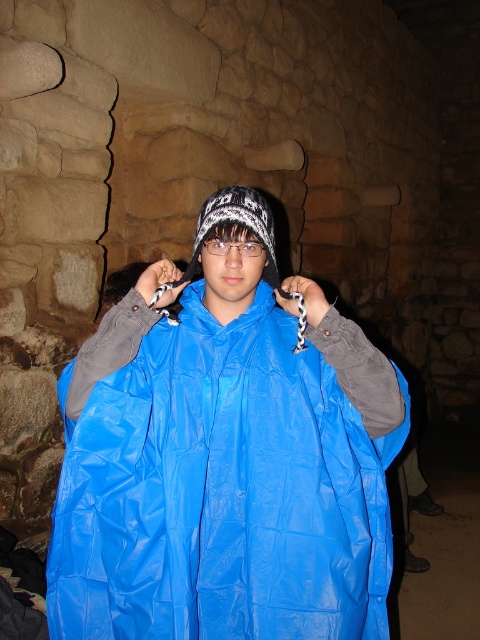
You are a tailor who needs to determine which item is wider between the blue shiny raincoat at center and the white knitted hat at center. Based on the scene, which one has a greater width?

The blue shiny raincoat at center has a greater width than the white knitted hat at center according to the description.

You are a fashion designer observing the image. You need to decide which item of clothing is taller between the blue shiny raincoat at center and the white knitted hat at center. Which one is taller?

The blue shiny raincoat at center is taller than the white knitted hat at center.